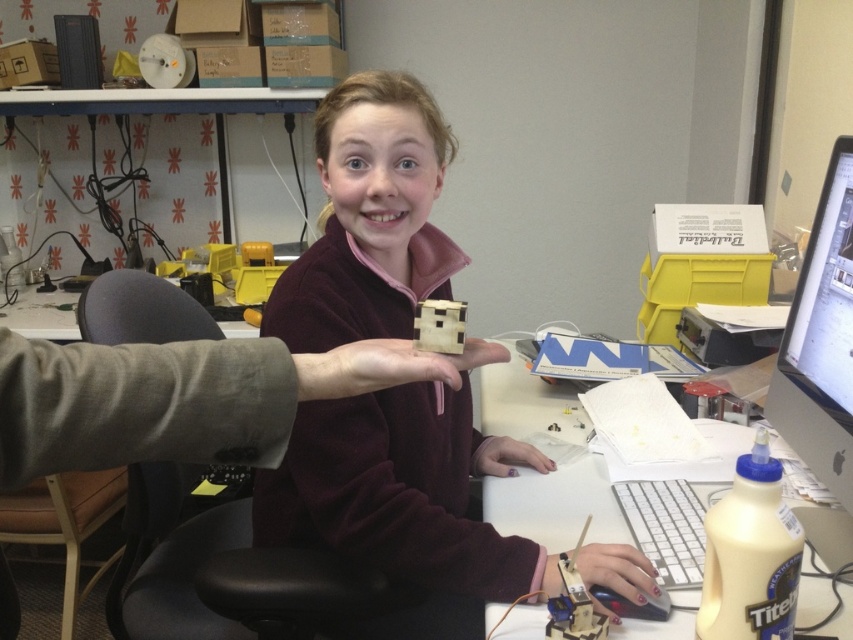
You are standing at the desk in the workspace and need to reach two points marked on the desk. The first point is at coordinate point(323, 157) and the second is at point(572, 422). Which point is closer to you?

Point(323, 157) is in front of point(572, 422), so it is closer to you.

In the scene shown: You are a delivery robot that needs to place a package on the white plastic computer desk at center without moving the wooden block at center. Can you do it if your arm can reach 10 inches?

The wooden block at center and white plastic computer desk at center are 10.51 inches apart. Since the robot arm can only reach 10 inches, it cannot place the package on the white plastic computer desk at center without moving the wooden block at center.

You are trying to reach the wooden block at center while sitting at the white plastic computer desk at center. Can you easily access it without moving from your seat?

The wooden block at center is in front of the white plastic computer desk at center, so it should be easily accessible while sitting at the desk without needing to move from your seat.